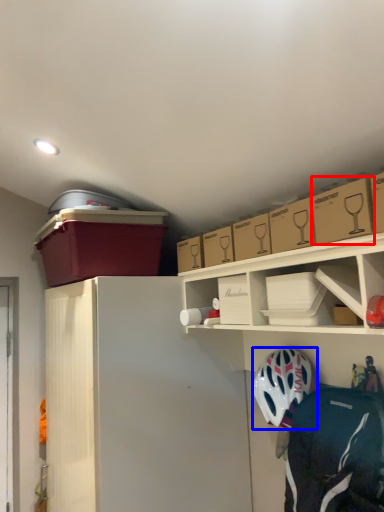
Question: Which object is closer to the camera taking this photo, cardboard box (highlighted by a red box) or helmet (highlighted by a blue box)?

Choices:
 (A) cardboard box
 (B) helmet

Answer: (A)